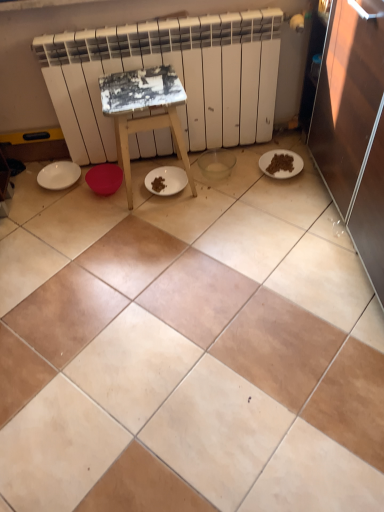
I want to click on free spot above beige ceramic tile at center (from a real-world perspective), so click(x=187, y=286).